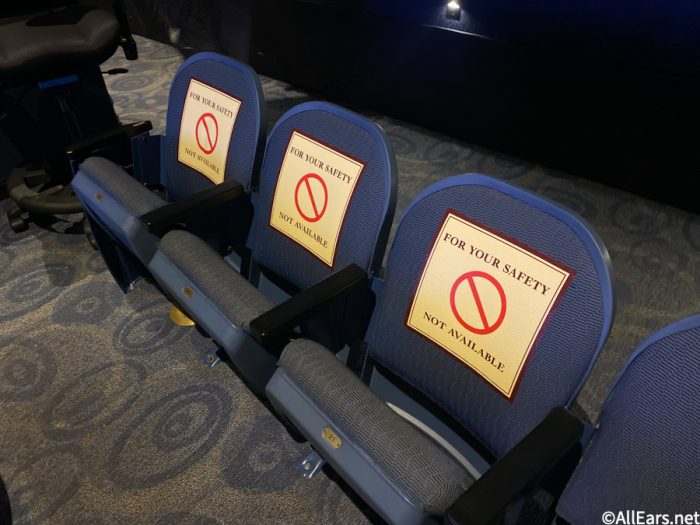
Where is `lock`? The image size is (700, 525). lock is located at coordinates (313, 454).